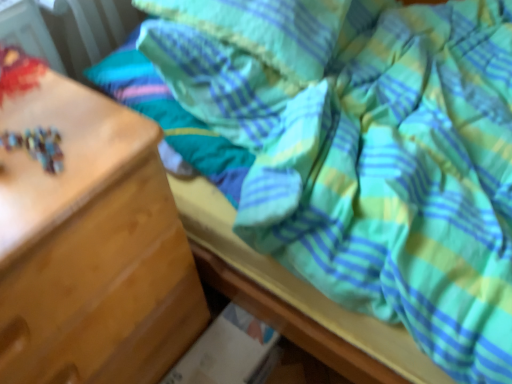
Question: Can you confirm if soft cotton pillow at upper center is positioned to the left of wooden chest of drawers at left?

Choices:
 (A) yes
 (B) no

Answer: (B)

Question: Is soft cotton pillow at upper center aimed at wooden chest of drawers at left?

Choices:
 (A) no
 (B) yes

Answer: (A)

Question: Is soft cotton pillow at upper center thinner than wooden chest of drawers at left?

Choices:
 (A) yes
 (B) no

Answer: (A)

Question: Considering the relative sizes of soft cotton pillow at upper center and wooden chest of drawers at left in the image provided, is soft cotton pillow at upper center taller than wooden chest of drawers at left?

Choices:
 (A) no
 (B) yes

Answer: (A)

Question: Does soft cotton pillow at upper center have a lesser height compared to wooden chest of drawers at left?

Choices:
 (A) yes
 (B) no

Answer: (A)

Question: Is the depth of soft cotton pillow at upper center greater than that of wooden chest of drawers at left?

Choices:
 (A) yes
 (B) no

Answer: (A)

Question: Does wooden chest of drawers at left appear on the right side of soft cotton pillow at upper center?

Choices:
 (A) yes
 (B) no

Answer: (B)

Question: Considering the relative sizes of wooden chest of drawers at left and soft cotton pillow at upper center in the image provided, is wooden chest of drawers at left bigger than soft cotton pillow at upper center?

Choices:
 (A) yes
 (B) no

Answer: (A)

Question: Is wooden chest of drawers at left surrounding soft cotton pillow at upper center?

Choices:
 (A) yes
 (B) no

Answer: (B)

Question: Considering the relative sizes of wooden chest of drawers at left and soft cotton pillow at upper center in the image provided, is wooden chest of drawers at left thinner than soft cotton pillow at upper center?

Choices:
 (A) yes
 (B) no

Answer: (B)

Question: Can we say wooden chest of drawers at left lies outside soft cotton pillow at upper center?

Choices:
 (A) no
 (B) yes

Answer: (B)

Question: From a real-world perspective, is wooden chest of drawers at left positioned under soft cotton pillow at upper center based on gravity?

Choices:
 (A) yes
 (B) no

Answer: (A)

Question: From the image's perspective, is soft cotton pillow at upper center above or below wooden chest of drawers at left?

Choices:
 (A) below
 (B) above

Answer: (B)